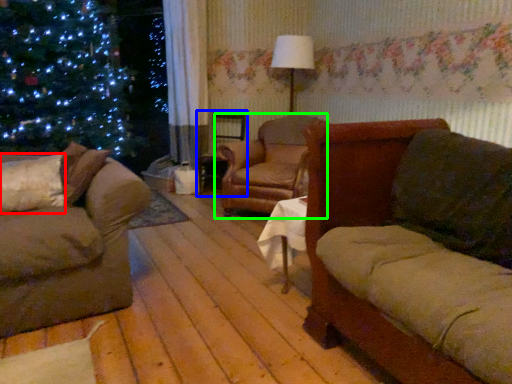
Question: Which is farther away from pillow (highlighted by a red box)? swivel chair (highlighted by a blue box) or chair (highlighted by a green box)?

Choices:
 (A) swivel chair
 (B) chair

Answer: (A)